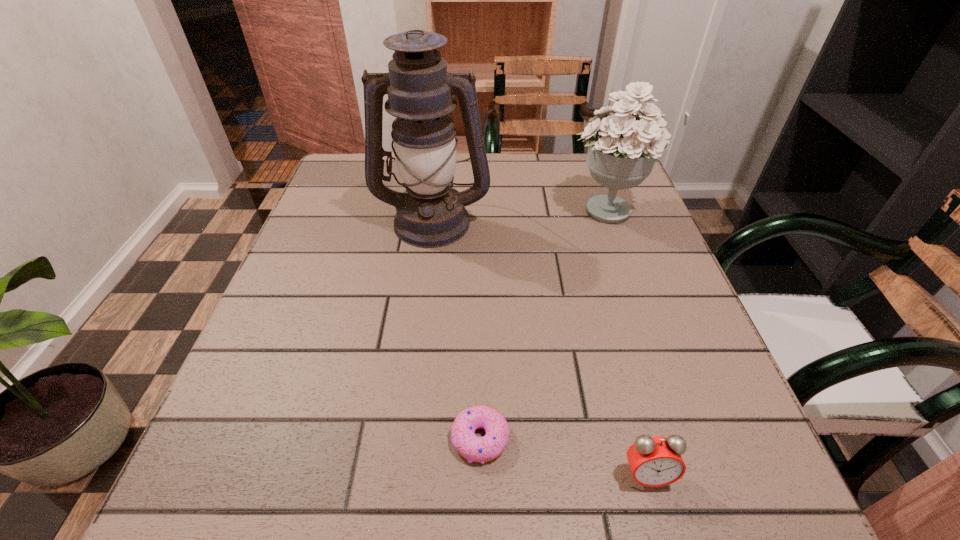
Where is `vacant area that lies between the oil lamp and the third tallest object`? The image size is (960, 540). vacant area that lies between the oil lamp and the third tallest object is located at coordinates (540, 348).

At what (x,y) coordinates should I click in order to perform the action: click on empty space between the bouquet and the doughnut. Please return your answer as a coordinate pair (x, y). Image resolution: width=960 pixels, height=540 pixels. Looking at the image, I should click on (543, 324).

Image resolution: width=960 pixels, height=540 pixels. Identify the location of vacant space in between the oil lamp and the doughnut. (456, 329).

Identify the location of the third closest object to the shortest object. click(x=622, y=149).

You are a GUI agent. You are given a task and a screenshot of the screen. Output one action in this format:
    pyautogui.click(x=<x>, y=<y>)
    Task: Click on the object that can be found as the second closest to the tallest object
    
    Given the screenshot: What is the action you would take?
    pyautogui.click(x=473, y=448)